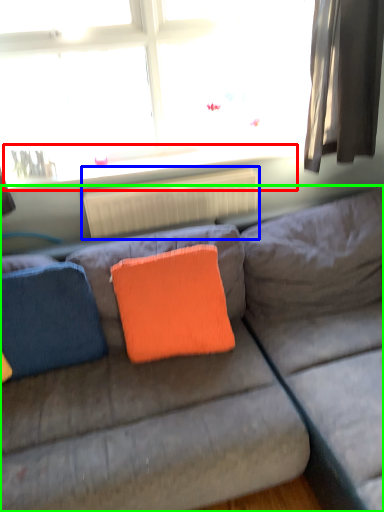
Question: Which is farther away from window sill (highlighted by a red box)? radiator (highlighted by a blue box) or studio couch (highlighted by a green box)?

Choices:
 (A) radiator
 (B) studio couch

Answer: (B)